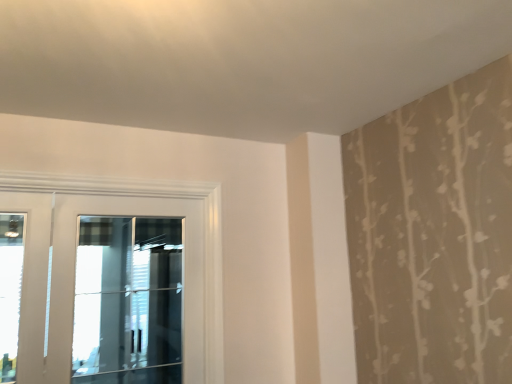
The width and height of the screenshot is (512, 384). Describe the element at coordinates (73, 279) in the screenshot. I see `white glass door at left` at that location.

The height and width of the screenshot is (384, 512). I want to click on white glass door at left, so click(73, 279).

Identify the location of white glass door at left. The image size is (512, 384). (73, 279).